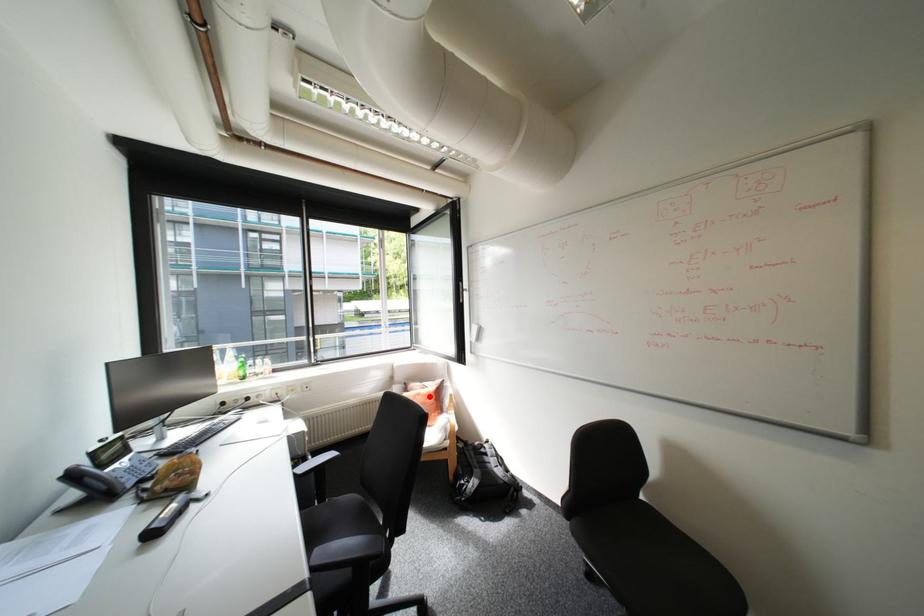
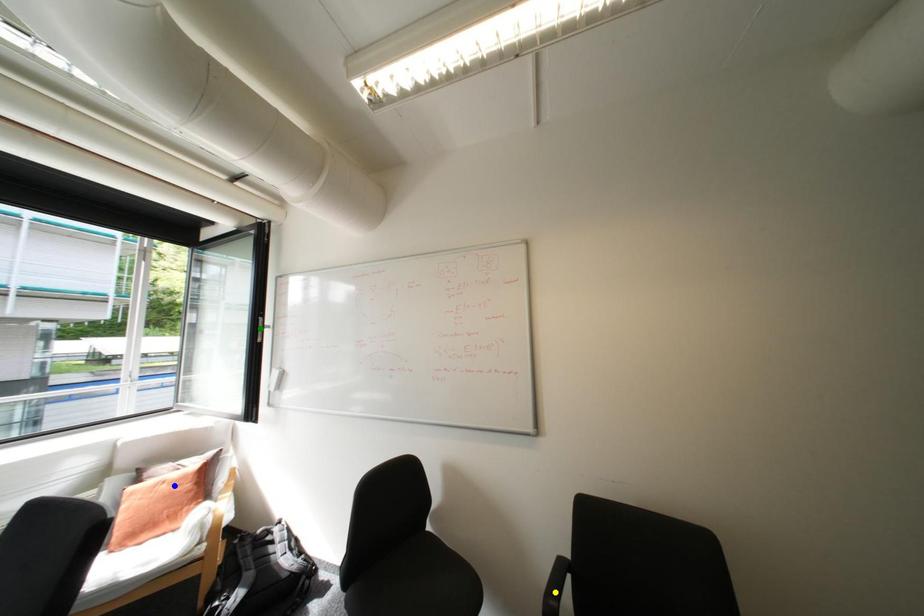
Question: I am providing you with two images of the same scene from different viewpoints. A red point is marked on the first image. You are given multiple points on the second image. Can you choose the point in image 2 that corresponds to the point in image 1?

Choices:
 (A) green point
 (B) yellow point
 (C) blue point

Answer: (C)